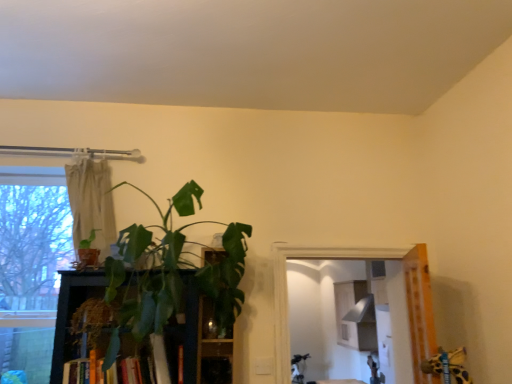
Question: Is green matte plant at left, positioned as the first houseplant in left-to-right order, positioned beyond the bounds of green leafy plant at center, which is the 2th houseplant from left to right?

Choices:
 (A) no
 (B) yes

Answer: (A)

Question: Is the depth of green matte plant at left, the 2th houseplant positioned from the right, greater than that of green leafy plant at center, which is the first houseplant in right-to-left order?

Choices:
 (A) yes
 (B) no

Answer: (A)

Question: Is green matte plant at left, positioned as the first houseplant in left-to-right order, positioned in front of green leafy plant at center, which is the 2th houseplant from left to right?

Choices:
 (A) no
 (B) yes

Answer: (A)

Question: Is green matte plant at left, positioned as the first houseplant in left-to-right order, oriented away from green leafy plant at center, which is the 2th houseplant from left to right?

Choices:
 (A) no
 (B) yes

Answer: (B)

Question: Are green matte plant at left, the 2th houseplant positioned from the right, and green leafy plant at center, which is the 2th houseplant from left to right, making contact?

Choices:
 (A) yes
 (B) no

Answer: (B)

Question: Can green leafy plant at center, which is the 2th houseplant from left to right, be found inside green matte plant at left, positioned as the first houseplant in left-to-right order?

Choices:
 (A) no
 (B) yes

Answer: (A)

Question: Is green leafy plant at center facing towards green matte plant at left, positioned as the first houseplant in left-to-right order?

Choices:
 (A) yes
 (B) no

Answer: (B)

Question: From a real-world perspective, is green leafy plant at center on top of green matte plant at left, positioned as the first houseplant in left-to-right order?

Choices:
 (A) no
 (B) yes

Answer: (A)

Question: Is green leafy plant at center at the left side of green matte plant at left, positioned as the first houseplant in left-to-right order?

Choices:
 (A) yes
 (B) no

Answer: (B)

Question: Is green leafy plant at center in front of green matte plant at left, positioned as the first houseplant in left-to-right order?

Choices:
 (A) no
 (B) yes

Answer: (A)

Question: Can you confirm if green leafy plant at center is shorter than green matte plant at left, the 2th houseplant positioned from the right?

Choices:
 (A) yes
 (B) no

Answer: (B)

Question: Is green leafy plant at center beside green matte plant at left, positioned as the first houseplant in left-to-right order?

Choices:
 (A) no
 (B) yes

Answer: (A)

Question: Does beige fabric curtain at upper left have a smaller size compared to green leafy plant at center?

Choices:
 (A) yes
 (B) no

Answer: (A)